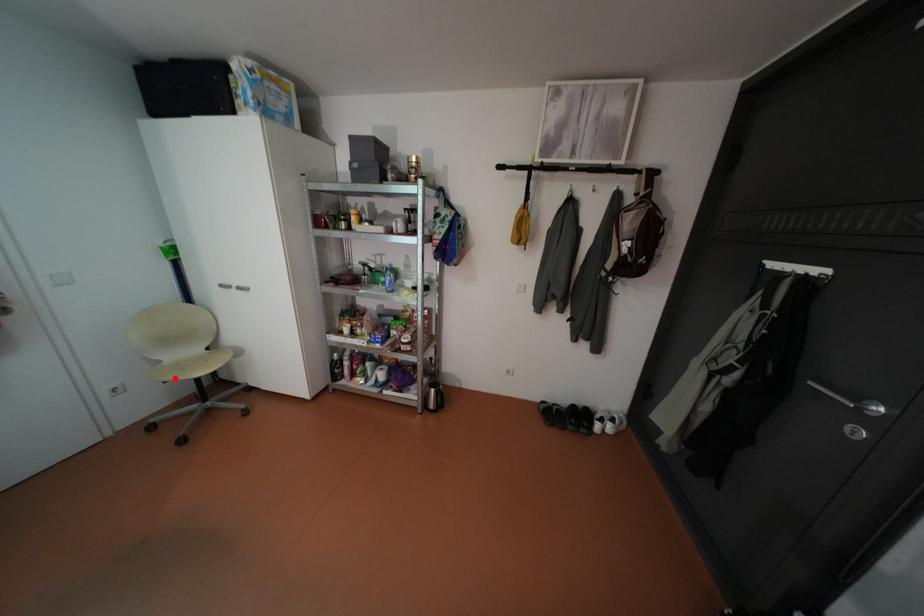
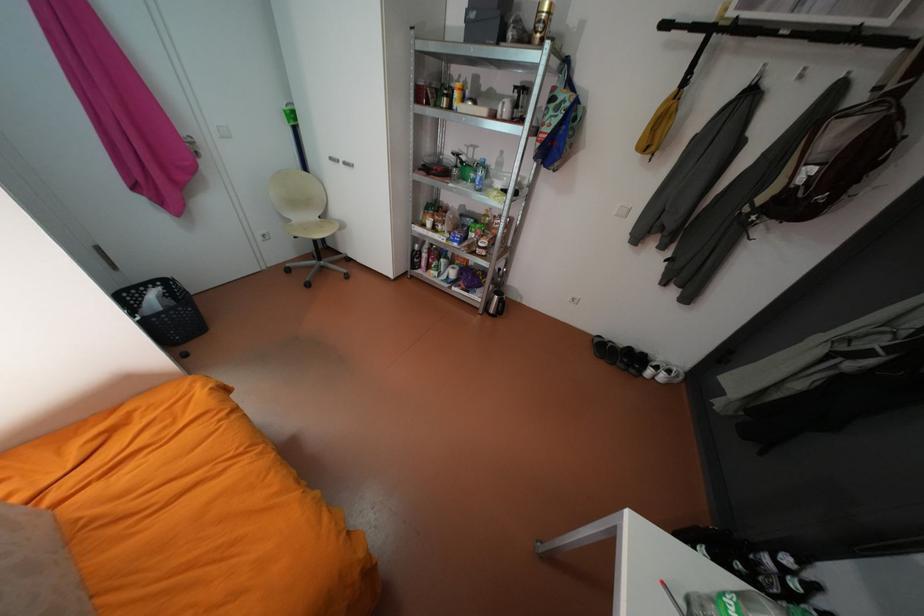
Question: I am providing you with two images of the same scene from different viewpoints. In image1, a red point is highlighted. Considering the same 3D point in image2, which of the following is correct?

Choices:
 (A) It is closer
 (B) It is farther

Answer: (A)